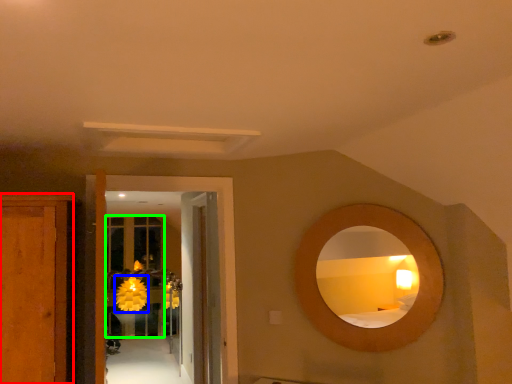
Question: Based on their relative distances, which object is farther from cabinetry (highlighted by a red box)? Choose from flower (highlighted by a blue box) and glass door (highlighted by a green box).

Choices:
 (A) flower
 (B) glass door

Answer: (A)